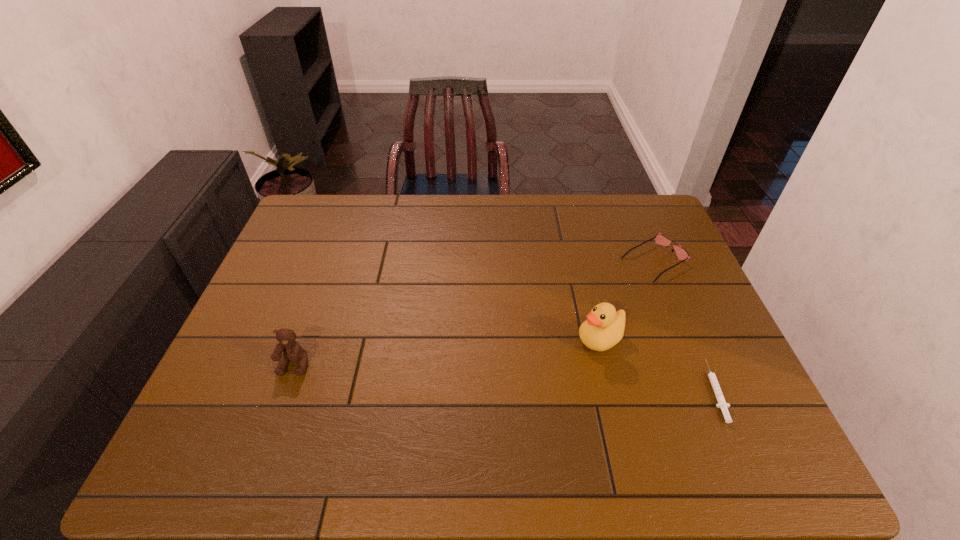
Where is `free point that satisfies the following two spatial constraints: 1. on the front side of the duck; 2. on the right side of the syringe`? free point that satisfies the following two spatial constraints: 1. on the front side of the duck; 2. on the right side of the syringe is located at coordinates (613, 390).

Locate an element on the screen. The image size is (960, 540). free location that satisfies the following two spatial constraints: 1. on the front side of the duck; 2. on the left side of the syringe is located at coordinates (613, 390).